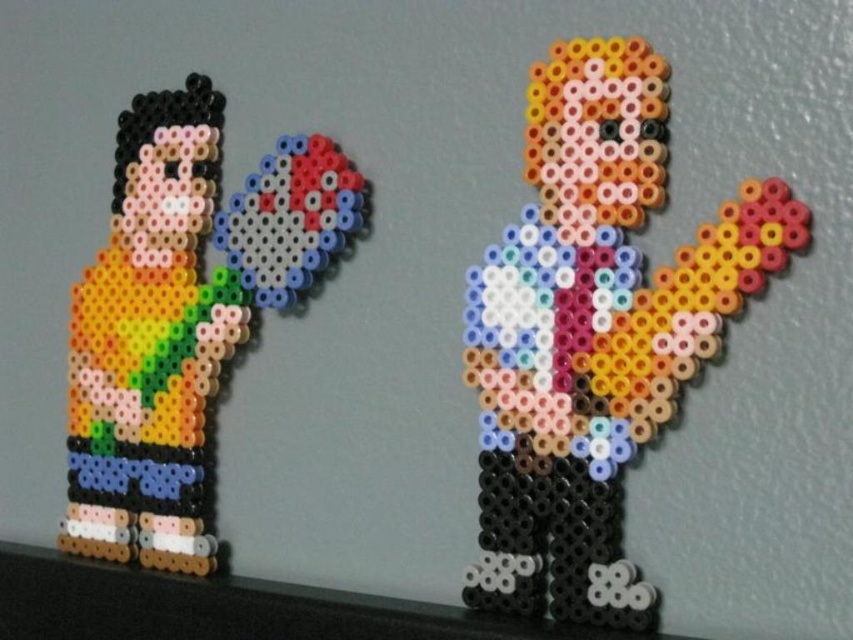
Question: Observing the image, what is the correct spatial positioning of multicolored beads man at center in reference to multicolored beads at left?

Choices:
 (A) left
 (B) right

Answer: (B)

Question: Can you confirm if multicolored beads man at center is wider than multicolored beads at left?

Choices:
 (A) yes
 (B) no

Answer: (B)

Question: Which of the following is the closest to the observer?

Choices:
 (A) multicolored beads at left
 (B) multicolored beads man at center

Answer: (B)

Question: Is multicolored beads man at center thinner than multicolored beads at left?

Choices:
 (A) yes
 (B) no

Answer: (A)

Question: Which point is closer to the camera?

Choices:
 (A) (183, 106)
 (B) (601, 88)

Answer: (B)